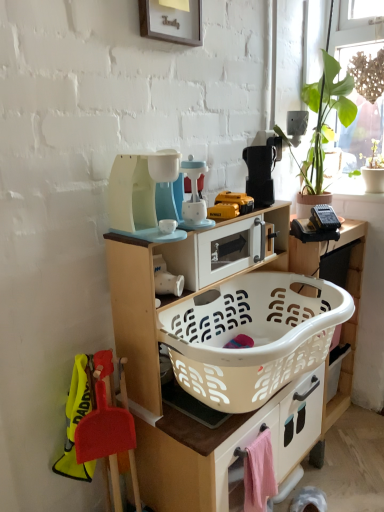
Question: Is matte plastic toy coffee maker at center, which is counted as the 4th appliance, starting from the right, in front of or behind black plastic toaster at upper center, placed as the 4th appliance when sorted from left to right, in the image?

Choices:
 (A) front
 (B) behind

Answer: (A)

Question: From a real-world perspective, relative to black plastic toaster at upper center, the first appliance from the right, is matte plastic toy coffee maker at center, which is counted as the 4th appliance, starting from the right, vertically above or below?

Choices:
 (A) above
 (B) below

Answer: (A)

Question: Based on their relative distances, which object is nearer to the woven wood screen at upper right?

Choices:
 (A) wooden frame at upper center
 (B) white plastic microwave at center, arranged as the 3th appliance when viewed from the left
 (C) yellow plastic drill at center
 (D) green leafy plant at upper right
 (E) white plastic laundry basket at center

Answer: (D)

Question: Which object is positioned closest to the pink fabric drawer at lower right?

Choices:
 (A) black plastic toaster at upper center, the first appliance from the right
 (B) yellow plastic drill at center
 (C) wooden frame at upper center
 (D) white plastic microwave at center, the second appliance in the right-to-left sequence
 (E) woven wood screen at upper right

Answer: (D)